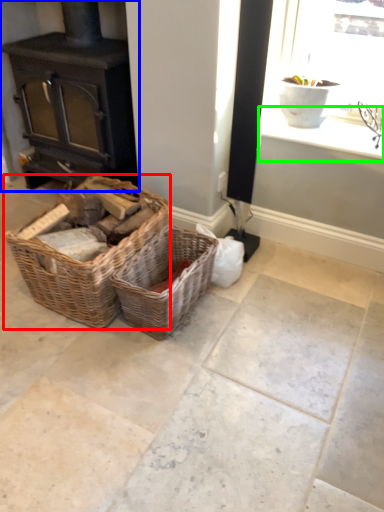
Question: Which object is the farthest from picnic basket (highlighted by a red box)? Choose among these: wood burning stove (highlighted by a blue box) or window sill (highlighted by a green box).

Choices:
 (A) wood burning stove
 (B) window sill

Answer: (B)